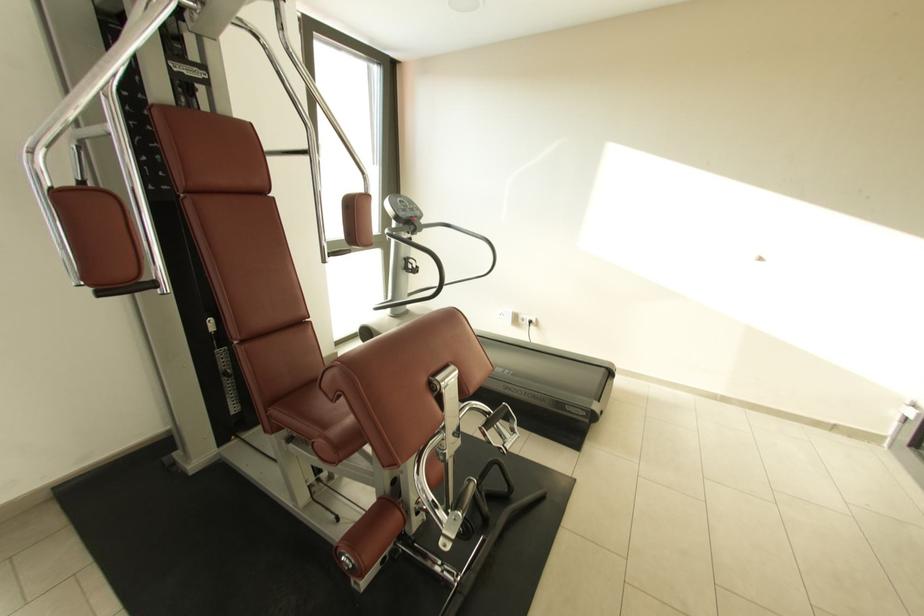
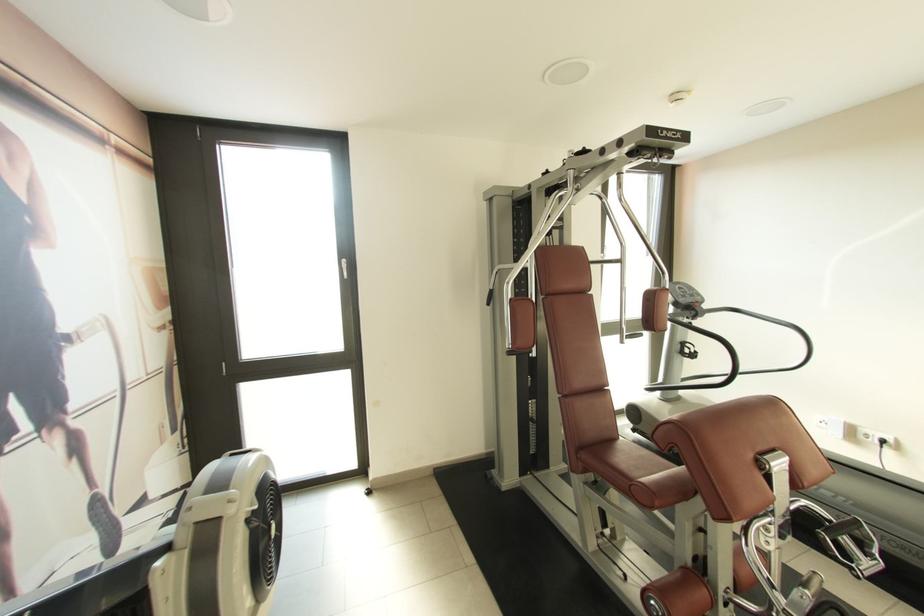
In the second image, find the point that corresponds to (526,317) in the first image.

(868, 432)